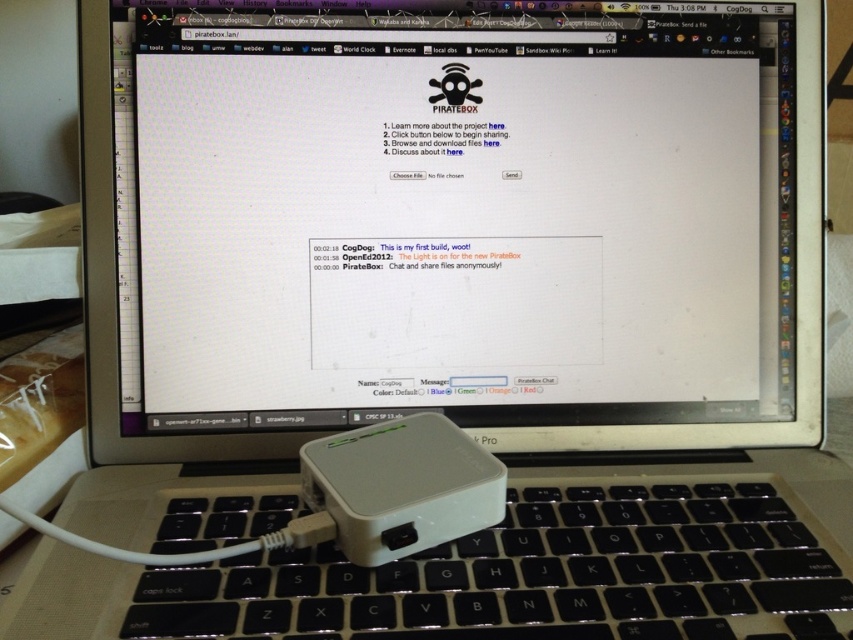
You are setting up a new PirateBox and have a small desk with limited space. You need to place both the black plastic keyboard at lower center and the white plastic ipod at center on the desk. Considering their sizes, which item should you place closer to the edge of the desk to save space?

The black plastic keyboard at lower center is larger in size than the white plastic ipod at center, so placing the larger keyboard closer to the edge would not save space. Instead, place the smaller white plastic ipod at center near the edge to conserve desk space.

You are a user trying to access the PirateBox webpage displayed on the laptop screen. You notice the black plastic keyboard at lower center and the white plastic ipod at center. Which object is located to the right of the other?

The black plastic keyboard at lower center is positioned on the right side of white plastic ipod at center, so the keyboard is to the right of the iPod.